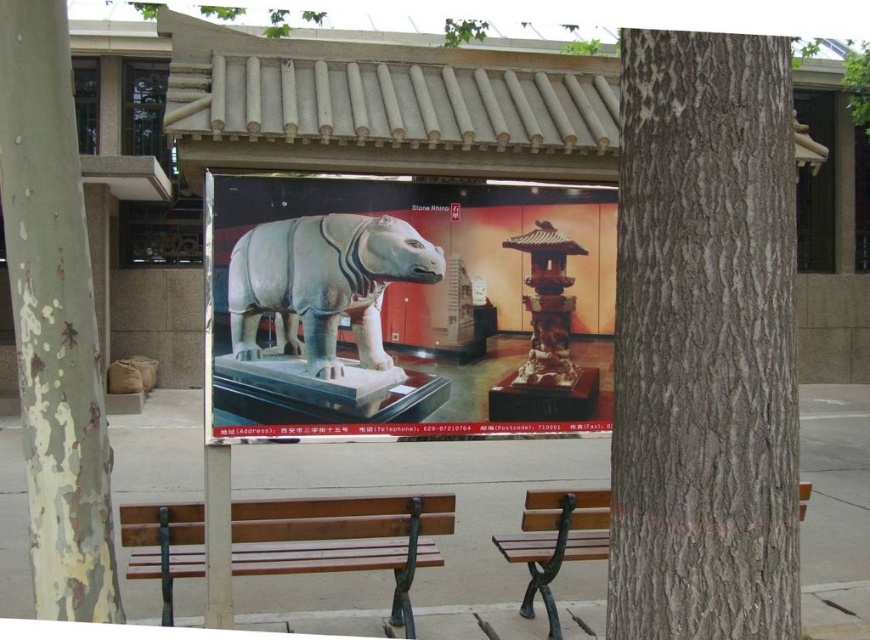
Question: Can you confirm if white stone statue at center is bigger than green bark tree trunk at left?

Choices:
 (A) no
 (B) yes

Answer: (B)

Question: Which point is farther to the camera?

Choices:
 (A) (298, 278)
 (B) (527, 566)

Answer: (B)

Question: Which of the following is the closest to the observer?

Choices:
 (A) green bark tree trunk at left
 (B) wooden bench at center
 (C) polished bronze pagoda at center

Answer: (A)

Question: Is wooden bench at center wider than brown wooden bench at center?

Choices:
 (A) no
 (B) yes

Answer: (B)

Question: Considering the real-world distances, which object is farthest from the polished bronze pagoda at center?

Choices:
 (A) gray rough bark tree at right
 (B) green bark tree trunk at left
 (C) brown wooden bench at center

Answer: (B)

Question: Is gray rough bark tree at right below brown wooden bench at center?

Choices:
 (A) yes
 (B) no

Answer: (B)